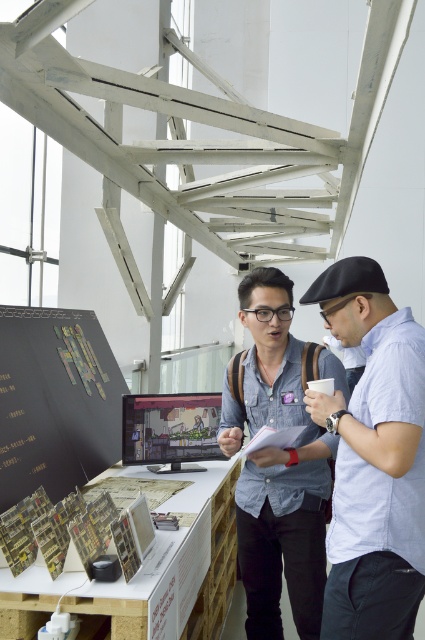
You are standing in the exhibition space and notice the light blue shirt at center. Can you determine its exact coordinates based on the room layout?

The light blue shirt at center is located at point [373,458], so its coordinates are precise within the room layout.

Looking at this image, you are standing at the entrance of the exhibition space and see the point marked at coordinates (x=373, y=458). What object or person is located at that point?

The point at coordinates (x=373, y=458) corresponds to the light blue shirt at center.